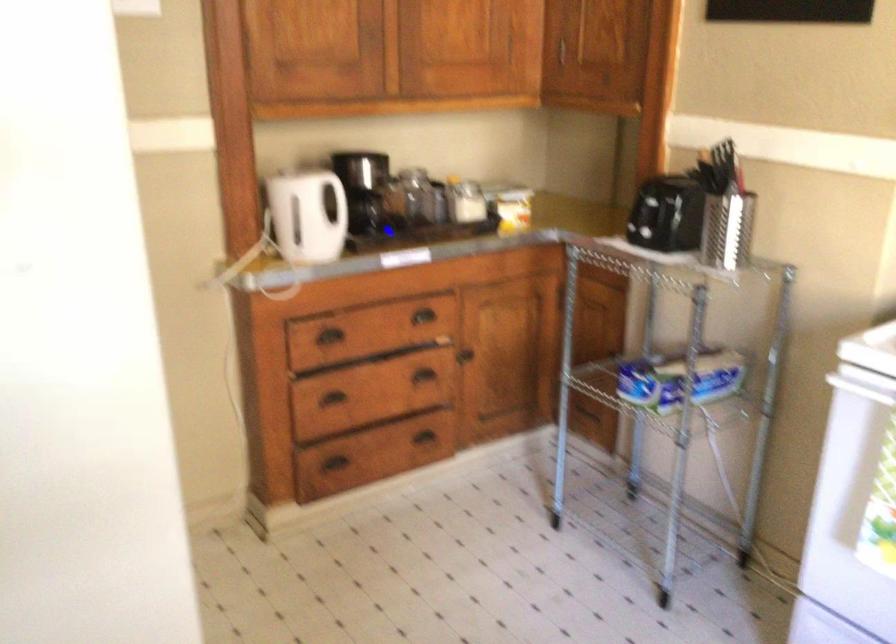
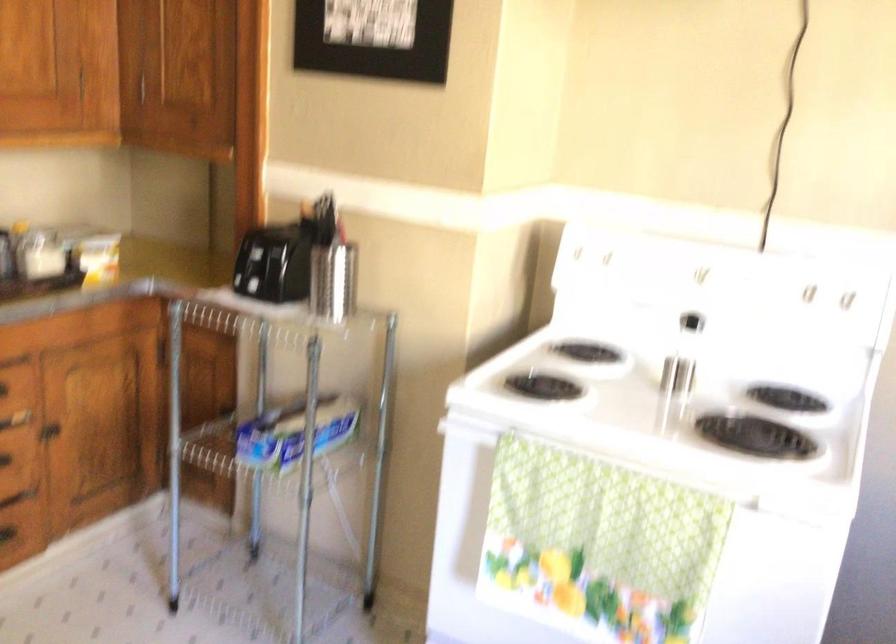
The point at (435, 406) is marked in the first image. Where is the corresponding point in the second image?

(22, 493)